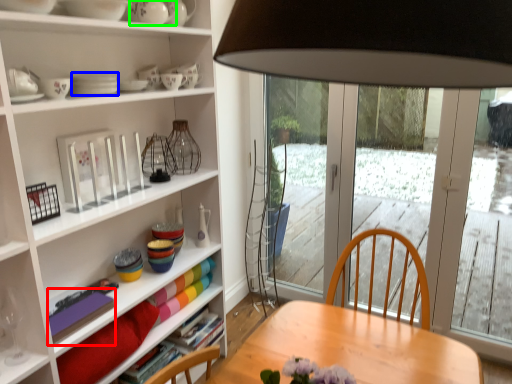
Question: Which object is the closest to the book (highlighted by a red box)? Choose among these: tableware (highlighted by a blue box) or tableware (highlighted by a green box).

Choices:
 (A) tableware
 (B) tableware

Answer: (A)